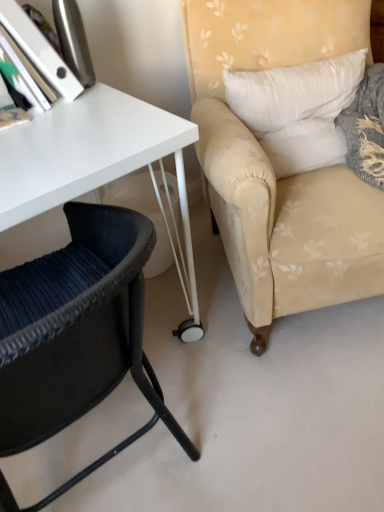
At what (x,y) coordinates should I click in order to perform the action: click on vacant area that lies to the right of black woven chair at lower left, arranged as the 2th chair when viewed from the right. Please return your answer as a coordinate pair (x, y). The height and width of the screenshot is (512, 384). Looking at the image, I should click on (272, 419).